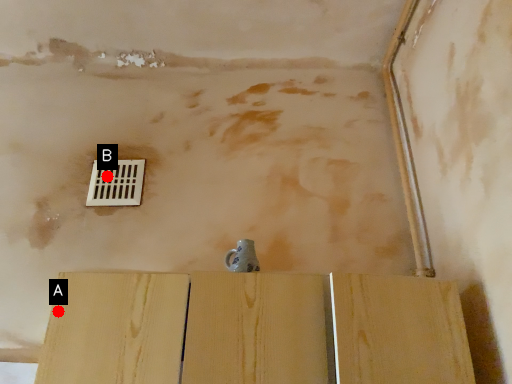
Question: Two points are circled on the image, labeled by A and B beside each circle. Which point is closer to the camera?

Choices:
 (A) A is closer
 (B) B is closer

Answer: (A)